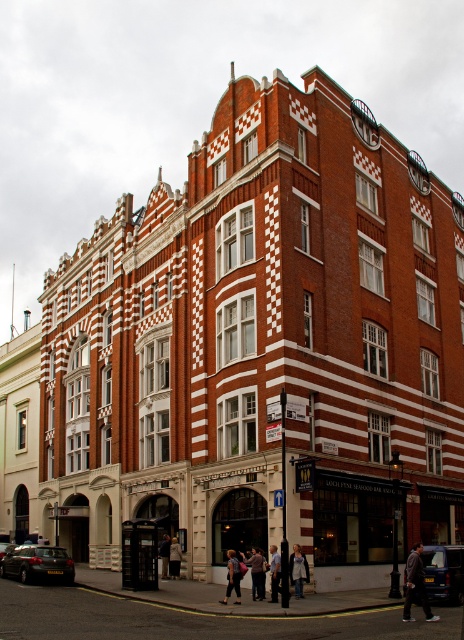
The height and width of the screenshot is (640, 464). What do you see at coordinates (416, 584) in the screenshot?
I see `dark brown leather jacket at lower right` at bounding box center [416, 584].

Who is lower down, dark brown leather jacket at lower right or light beige fabric handbag at lower center?

Positioned lower is light beige fabric handbag at lower center.

Between point (413, 566) and point (174, 548), which one is positioned in front?

Point (413, 566)

The height and width of the screenshot is (640, 464). Identify the location of dark brown leather jacket at lower right. (416, 584).

Who is lower down, denim jacket at lower center or light beige fabric coat at lower center?

light beige fabric coat at lower center is lower down.

Which is more to the left, denim jacket at lower center or light beige fabric coat at lower center?

light beige fabric coat at lower center is more to the left.

Describe the element at coordinates (232, 577) in the screenshot. The width and height of the screenshot is (464, 640). I see `denim jacket at lower center` at that location.

Find the location of a particular element. Image resolution: width=464 pixels, height=640 pixels. denim jacket at lower center is located at coordinates (232, 577).

Between point (427, 605) and point (161, 577), which one is positioned behind?

Point (161, 577)

Does dark brown leather jacket at lower right have a greater width compared to light beige fabric coat at lower center?

Yes.

Which is behind, point (418, 579) or point (167, 550)?

The point (167, 550) is behind.

Identify the location of dark brown leather jacket at lower right. (416, 584).